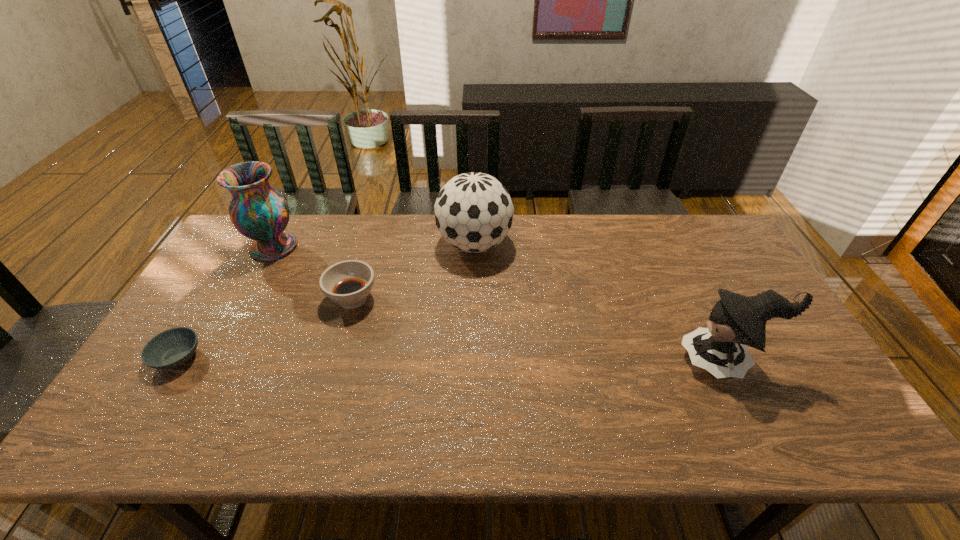
You are a GUI agent. You are given a task and a screenshot of the screen. Output one action in this format:
    pyautogui.click(x=<x>, y=<y>)
    Task: Click on the blank space located at the face of the doll
    This screenshot has height=540, width=960.
    Given the screenshot: What is the action you would take?
    tap(591, 361)

Find the location of `vacant space located at the face of the doll`. vacant space located at the face of the doll is located at coordinates (641, 361).

You are a GUI agent. You are given a task and a screenshot of the screen. Output one action in this format:
    pyautogui.click(x=<x>, y=<y>)
    Task: Click on the vacant space situated 0.180m on the left of the third object from left to right
    
    Given the screenshot: What is the action you would take?
    pyautogui.click(x=266, y=299)

Where is `vacant space positioned 0.280m on the right of the nearer soup bowl`? The height and width of the screenshot is (540, 960). vacant space positioned 0.280m on the right of the nearer soup bowl is located at coordinates (310, 357).

This screenshot has width=960, height=540. Find the location of `vase located in the far edge section of the desktop`. vase located in the far edge section of the desktop is located at coordinates (259, 212).

At what (x,y) coordinates should I click in order to perform the action: click on soccer ball present at the far edge. Please return your answer as a coordinate pair (x, y). Image resolution: width=960 pixels, height=540 pixels. Looking at the image, I should click on (x=473, y=211).

You are a GUI agent. You are given a task and a screenshot of the screen. Output one action in this format:
    pyautogui.click(x=<x>, y=<y>)
    Task: Click on the vase at the left edge
    The height and width of the screenshot is (540, 960).
    Given the screenshot: What is the action you would take?
    pyautogui.click(x=259, y=212)

The image size is (960, 540). Find the location of `soup bowl positioned at the left edge`. soup bowl positioned at the left edge is located at coordinates [x=172, y=348].

Where is `object at the right edge`? The width and height of the screenshot is (960, 540). object at the right edge is located at coordinates (736, 321).

Where is `object positioned at the far left corner`? object positioned at the far left corner is located at coordinates (259, 212).